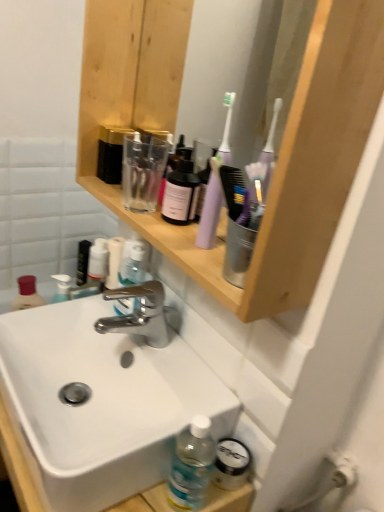
Image resolution: width=384 pixels, height=512 pixels. Find the location of `vacant region to the right of polished chrome faucet at center`. vacant region to the right of polished chrome faucet at center is located at coordinates (191, 365).